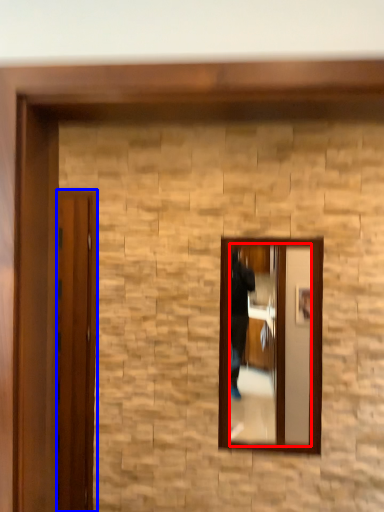
Question: Which point is closer to the camera, mirror (highlighted by a red box) or door (highlighted by a blue box)?

Choices:
 (A) mirror
 (B) door

Answer: (A)